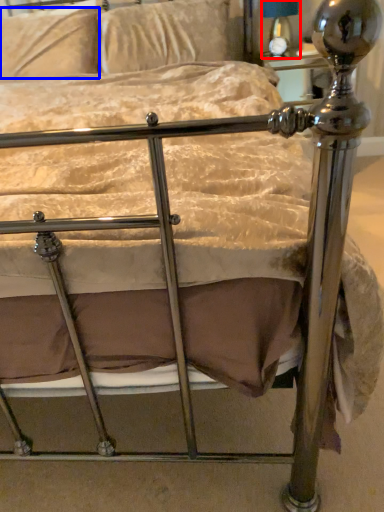
Question: Which object is further to the camera taking this photo, table lamp (highlighted by a red box) or pillow (highlighted by a blue box)?

Choices:
 (A) table lamp
 (B) pillow

Answer: (A)